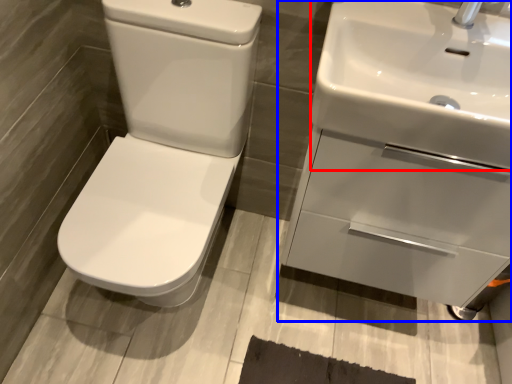
Question: Which object appears closest to the camera in this image, sink (highlighted by a red box) or sink (highlighted by a blue box)?

Choices:
 (A) sink
 (B) sink

Answer: (A)